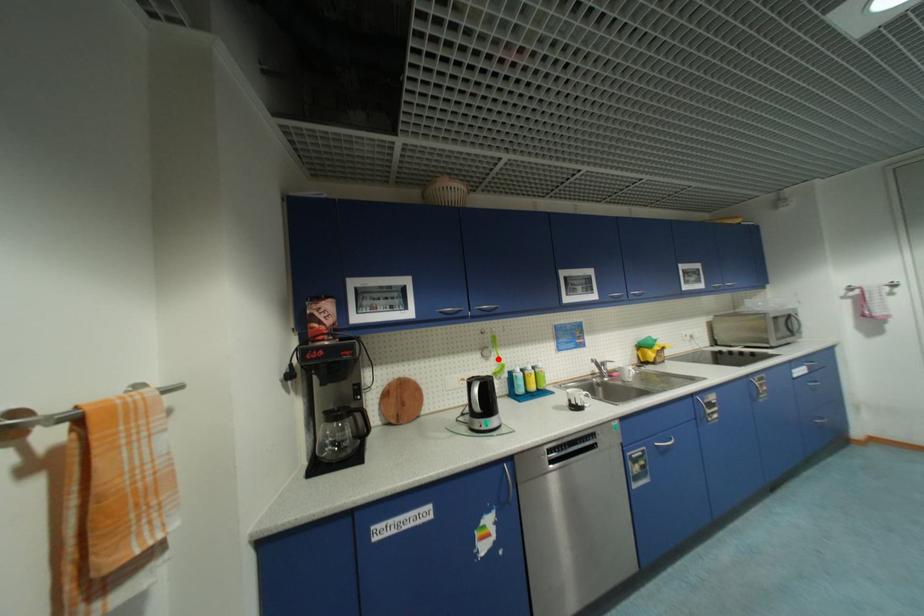
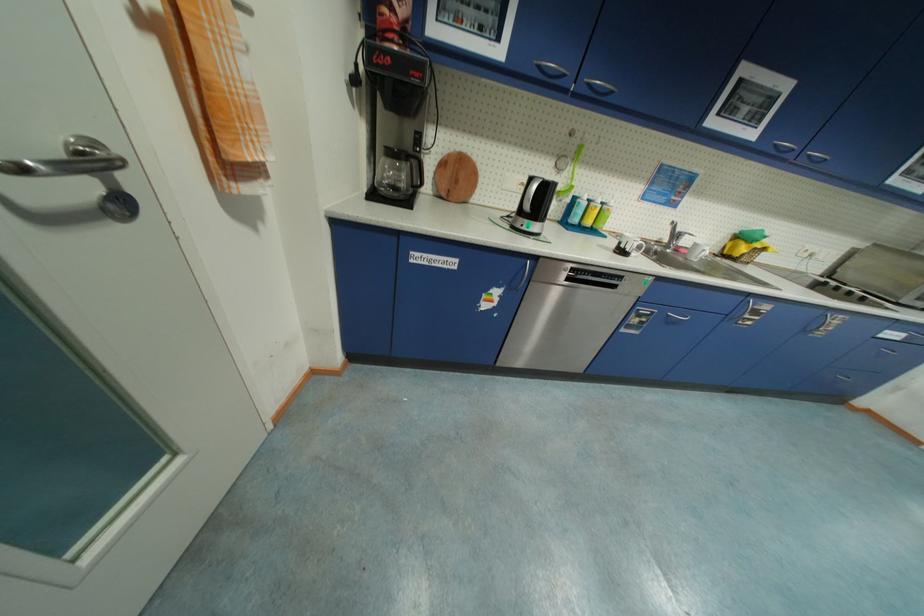
Question: I am providing you with two images of the same scene from different viewpoints. A red point is marked on the first image. At the location where the point appears in image 1, is it still visible in image 2?

Choices:
 (A) Yes
 (B) No

Answer: (A)